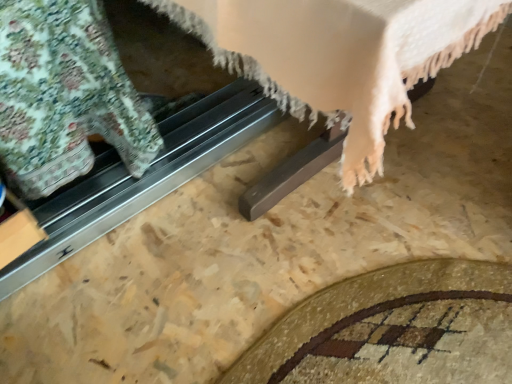
Where is `floral fabric at left`? floral fabric at left is located at coordinates click(65, 95).

The image size is (512, 384). What do you see at coordinates (65, 95) in the screenshot?
I see `floral fabric at left` at bounding box center [65, 95].

Identify the location of floral fabric at left. This screenshot has height=384, width=512. (65, 95).